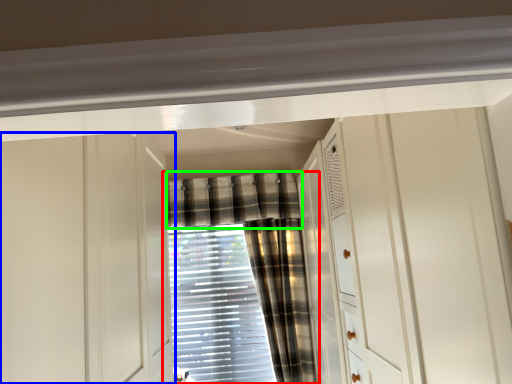
Question: Which object is the farthest from curtain (highlighted by a red box)? Choose among these: cabinetry (highlighted by a blue box) or curtain (highlighted by a green box).

Choices:
 (A) cabinetry
 (B) curtain

Answer: (A)